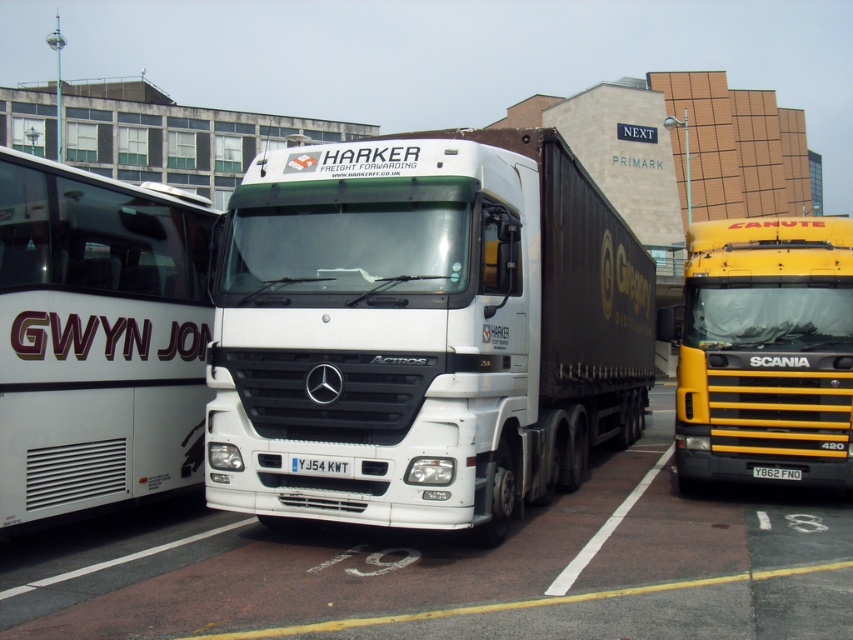
Question: Which object appears closest to the camera in this image?

Choices:
 (A) yellow metallic truck at right
 (B) black metal license plate at center
 (C) white glossy bus at left

Answer: (C)

Question: Which of these objects is positioned closest to the yellow metallic truck at right?

Choices:
 (A) white plastic license plate at center
 (B) white matte trailer truck at center

Answer: (B)

Question: Estimate the real-world distances between objects in this image. Which object is farther from the black metal license plate at center?

Choices:
 (A) white glossy bus at left
 (B) yellow metallic truck at right

Answer: (A)

Question: Does white glossy bus at left come in front of black metal license plate at center?

Choices:
 (A) yes
 (B) no

Answer: (A)

Question: Does yellow metallic truck at right appear under white plastic license plate at center?

Choices:
 (A) yes
 (B) no

Answer: (B)

Question: Does yellow metallic truck at right appear on the left side of black metal license plate at center?

Choices:
 (A) no
 (B) yes

Answer: (A)